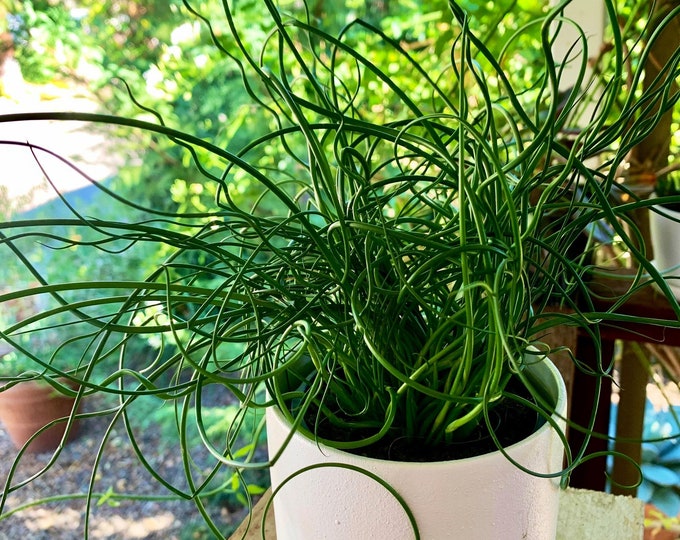
This screenshot has width=680, height=540. I want to click on clay pot, so click(x=24, y=414).